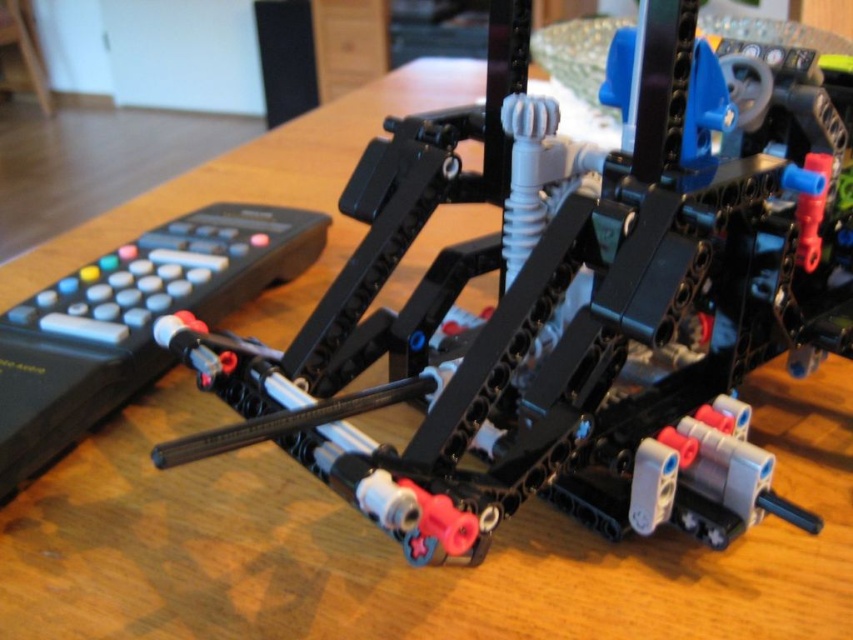
You are a child who wants to play with the black plastic toy at center and the black plastic remote at left. Which object is closer to you when you are standing in front of the table?

The black plastic remote at left is closer to you because it is positioned above the black plastic toy at center, meaning the toy is underneath the remote.

You are a photographer trying to capture the LEGO Technic model from a specific angle. You notice two points on the model labeled as point (740, 317) and point (201, 298). Which point would appear larger in your photo if you focus on the LEGO model?

Point (740, 317) is closer to the viewer than point (201, 298). Therefore, point (740, 317) would appear larger in the photo because objects closer to the camera generally appear larger than those further away.

You are a child who wants to play with the black plastic toy at center and the black plastic remote at left. If you place both items on a small shelf, which one will you need to adjust to make sure they both fit without overlapping?

The black plastic toy at center is taller than the black plastic remote at left, so you will need to adjust the height of the shelf to accommodate the taller toy.